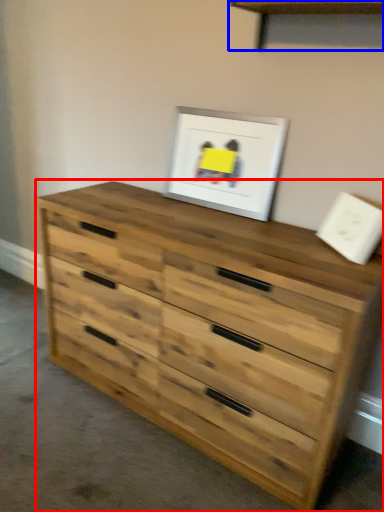
Question: Which point is closer to the camera, chest of drawers (highlighted by a red box) or shelf (highlighted by a blue box)?

Choices:
 (A) chest of drawers
 (B) shelf

Answer: (A)